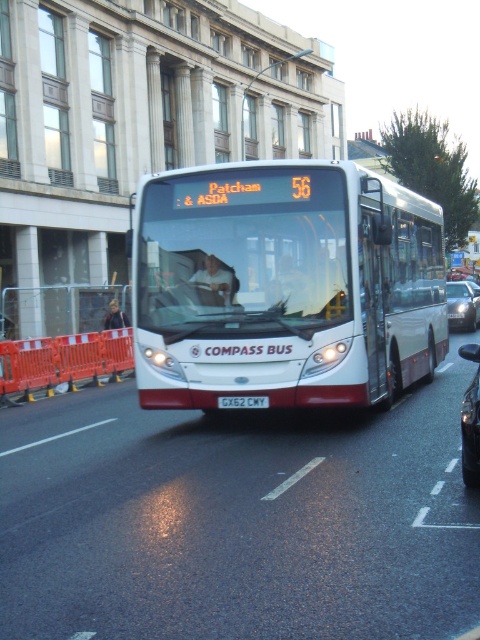
Question: Which is nearer to the metallic silver sedan at center?

Choices:
 (A) white rectangular license plate at center
 (B) white matte bus at center

Answer: (A)

Question: Which point is closer to the camera?

Choices:
 (A) (325, 298)
 (B) (474, 301)
 (C) (96, 378)

Answer: (A)

Question: Can you confirm if white matte bus at center is thinner than metallic silver sedan at center?

Choices:
 (A) no
 (B) yes

Answer: (B)

Question: Can you confirm if white matte bus at center is bigger than metallic silver sedan at center?

Choices:
 (A) yes
 (B) no

Answer: (B)

Question: Among these objects, which one is farthest from the camera?

Choices:
 (A) metallic silver car at center
 (B) white matte bus at center
 (C) white rectangular license plate at center
 (D) orange plastic barricade at left

Answer: (D)

Question: Does orange plastic barricade at left appear on the left side of metallic silver car at center?

Choices:
 (A) no
 (B) yes

Answer: (B)